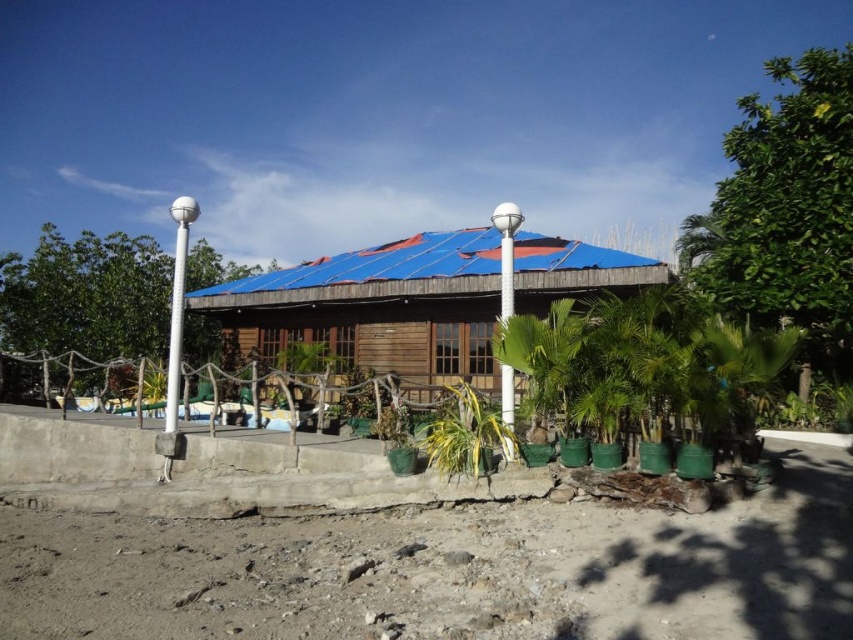
Question: In this image, where is wooden hut at center located relative to green leafy tree at left?

Choices:
 (A) left
 (B) right

Answer: (B)

Question: Is green leafy tree at left thinner than white plastic pole at center?

Choices:
 (A) yes
 (B) no

Answer: (B)

Question: Which point is closer to the camera?

Choices:
 (A) (433, 435)
 (B) (723, 209)

Answer: (A)

Question: Which is nearer to the green leafy tree at upper right?

Choices:
 (A) wooden hut at center
 (B) green leafy palm tree at center
 (C) white plastic pole at center

Answer: (A)

Question: Is green leafy tree at left positioned behind white plastic pole at center?

Choices:
 (A) no
 (B) yes

Answer: (B)

Question: Which point is farther from the camera taking this photo?

Choices:
 (A) (418, 280)
 (B) (509, 262)
 (C) (109, 275)

Answer: (C)